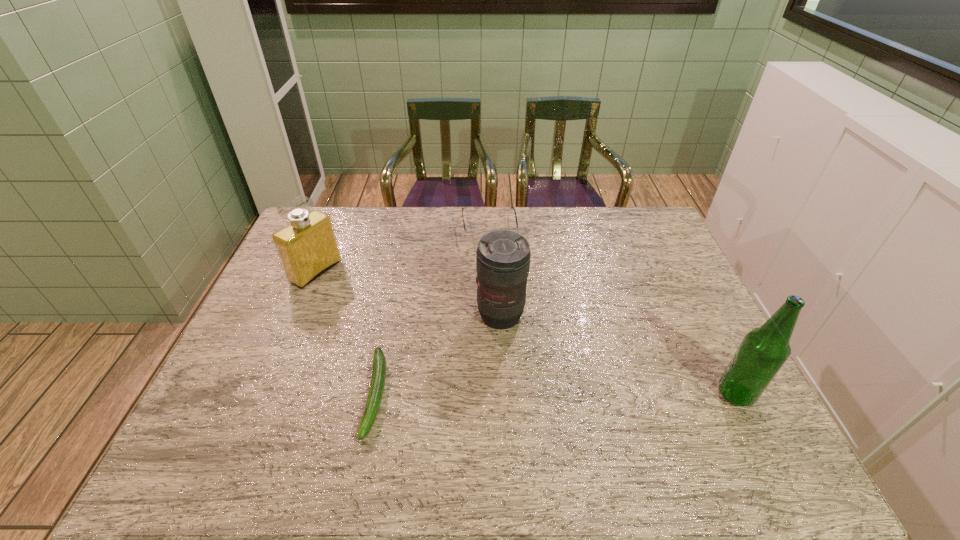
This screenshot has width=960, height=540. What are the coordinates of `vacant space located on the label of the rightmost object` in the screenshot? It's located at (557, 394).

The height and width of the screenshot is (540, 960). I want to click on free space located 0.120m on the label of the rightmost object, so click(668, 394).

What are the coordinates of `free space located on the front-facing side of the perfume` in the screenshot? It's located at (349, 291).

The height and width of the screenshot is (540, 960). I want to click on vacant space situated on the front-facing side of the perfume, so click(x=352, y=293).

Where is `vacant space located 0.260m on the front-facing side of the perfume`? The image size is (960, 540). vacant space located 0.260m on the front-facing side of the perfume is located at coordinates (395, 315).

You are a GUI agent. You are given a task and a screenshot of the screen. Output one action in this format:
    pyautogui.click(x=<x>, y=<y>)
    Task: Click on the vacant region located 0.200m on the side of the telephoto lens where the control switches are located
    
    Given the screenshot: What is the action you would take?
    pyautogui.click(x=535, y=394)

Image resolution: width=960 pixels, height=540 pixels. I want to click on blank space located on the side of the telephoto lens where the control switches are located, so click(543, 411).

The width and height of the screenshot is (960, 540). Identify the location of vacant area situated 0.240m on the side of the telephoto lens where the control switches are located. (541, 408).

Where is `blank area located on the front-facing side of the fourth tallest object`? Image resolution: width=960 pixels, height=540 pixels. blank area located on the front-facing side of the fourth tallest object is located at coordinates (495, 270).

Locate an element on the screen. The height and width of the screenshot is (540, 960). vacant space located on the front-facing side of the fourth tallest object is located at coordinates (497, 281).